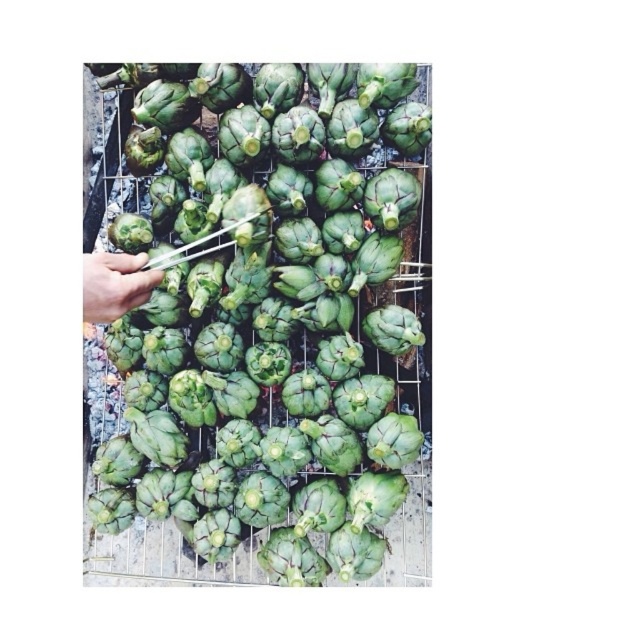
You are a chef preparing grilled artichokes. You need to place a new artichoke on the grill rack so that it is exactly at the center of the rack. The grill rack has a coordinate system where the bottom left corner is the origin. The existing artichokes are arranged in a random pattern. Can you confirm if the point at coordinates point (268, 346) is the center of the grill rack?

The point (268, 346) corresponds to the green matte artichoke at center, which is located at the center of the grill rack. Therefore, placing the new artichoke at this point will position it exactly at the center of the grill rack.

You are positioning a new grill lid that measures 1 meter in diameter. The lid must be centered exactly over the green matte artichoke at center. Given the grill rack is 1.2 meters in diameter, will the lid fit entirely within the grill rack without overhanging?

The green matte artichoke at center is located at point coordinates, so the lid centered there would have a radius of 0.5 meters. Since the grill rack has a radius of 0.6 meters, the lid will fit within the grill rack as the distance from the center to the edge of the lid is less than the grill rack.

You are a chef preparing grilled artichokes. You have two artichokes on the grill rack, the green matte artichoke at center and the smooth green artichoke at left. Which one will require more time to cook thoroughly?

The green matte artichoke at center is bigger than the smooth green artichoke at left, so it will require more time to cook thoroughly.